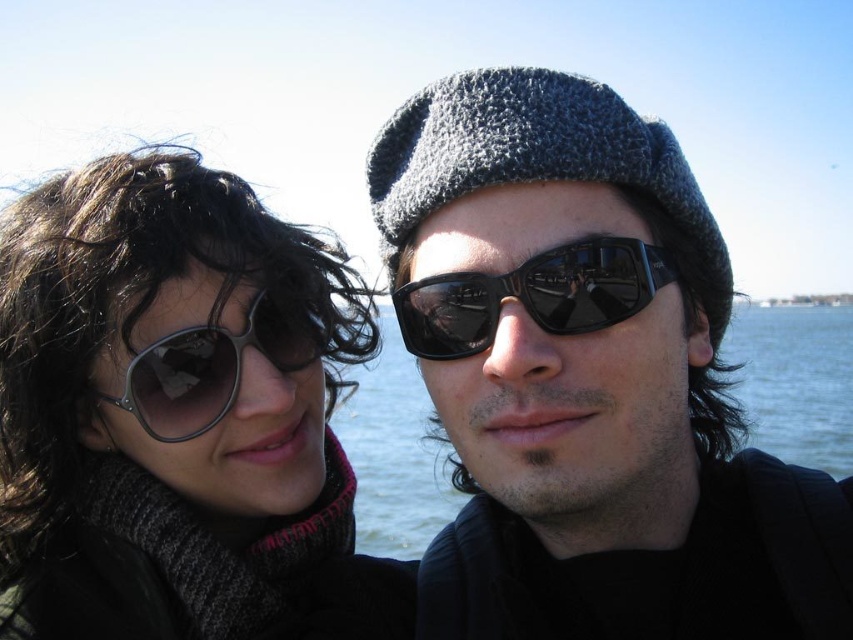
Does gray knitted beanie at center appear over metallic reflective sunglasses at left?

Yes, gray knitted beanie at center is above metallic reflective sunglasses at left.

Is gray knitted beanie at center to the right of metallic reflective sunglasses at left from the viewer's perspective?

Indeed, gray knitted beanie at center is positioned on the right side of metallic reflective sunglasses at left.

Who is more forward, (495, 86) or (271, 356)?

Point (495, 86) is in front.

Identify the location of gray knitted beanie at center. (540, 163).

Between point (175, 499) and point (473, 273), which one is positioned behind?

Point (175, 499)

Is matte black sunglasses at left positioned at the back of black reflective sunglasses at center?

Yes, matte black sunglasses at left is further from the viewer.

Where is `matte black sunglasses at left`? matte black sunglasses at left is located at coordinates (178, 417).

Can you confirm if matte black sunglasses at left is smaller than metallic reflective sunglasses at left?

Actually, matte black sunglasses at left might be larger than metallic reflective sunglasses at left.

Between matte black sunglasses at left and metallic reflective sunglasses at left, which one is positioned higher?

metallic reflective sunglasses at left is higher up.

Identify the location of matte black sunglasses at left. This screenshot has height=640, width=853. (178, 417).